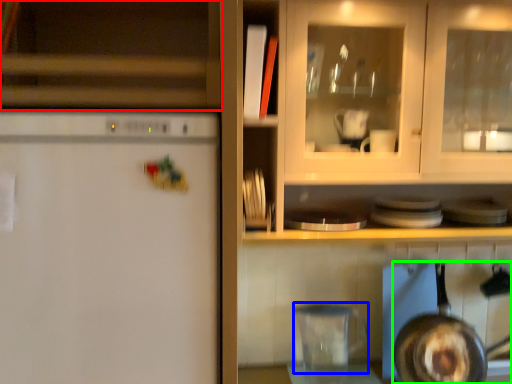
Question: Considering the real-world distances, which object is farthest from cabinetry (highlighted by a red box)? appliance (highlighted by a blue box) or frying pan (highlighted by a green box)?

Choices:
 (A) appliance
 (B) frying pan

Answer: (B)